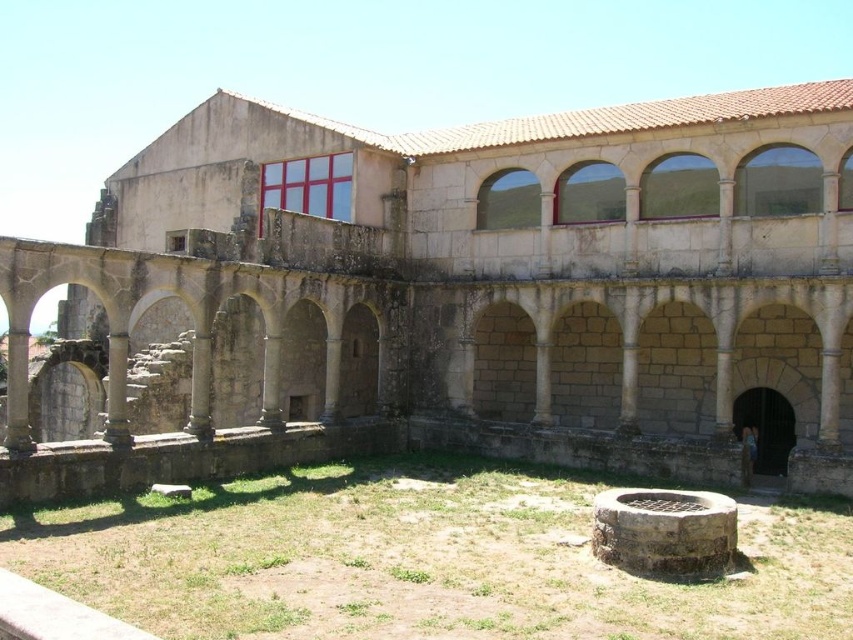
Is stone arches at center wider than brown stone well at center?

Correct, the width of stone arches at center exceeds that of brown stone well at center.

Is point (706, 401) farther from viewer compared to point (234, 637)?

Yes, point (706, 401) is behind point (234, 637).

Describe the element at coordinates (457, 294) in the screenshot. I see `stone arches at center` at that location.

Locate an element on the screen. This screenshot has width=853, height=640. stone arches at center is located at coordinates (457, 294).